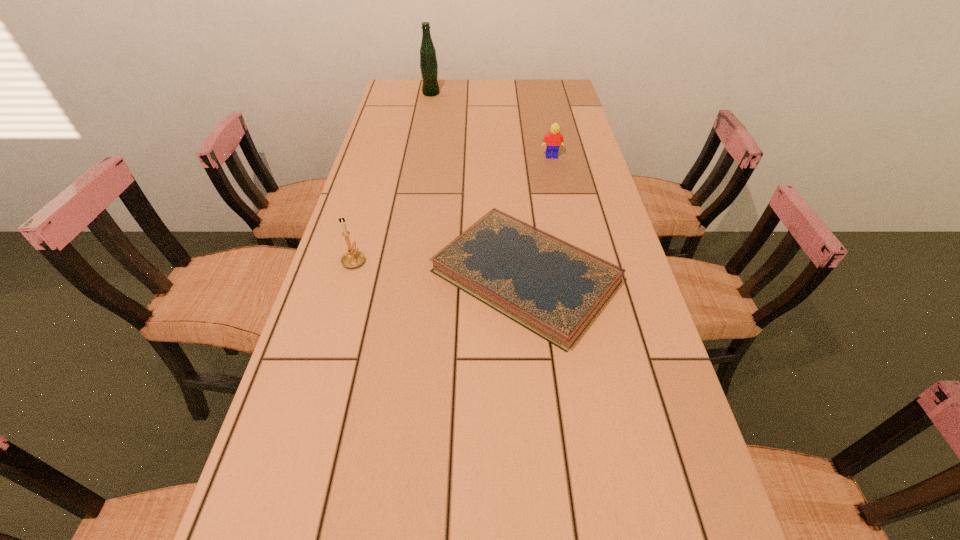
Find the location of a particular element. vacant space at the left edge is located at coordinates (351, 272).

Find the location of a particular element. vacant space at the right edge of the desktop is located at coordinates (672, 529).

This screenshot has width=960, height=540. Find the location of `vacant space at the far right corner`. vacant space at the far right corner is located at coordinates (548, 97).

The width and height of the screenshot is (960, 540). What are the coordinates of `vacant point located between the second tallest object and the third nearest object` in the screenshot? It's located at (453, 208).

In order to click on empty space that is in between the shortest object and the tallest object in this screenshot , I will do `click(478, 185)`.

I want to click on free space between the second farthest object and the beer bottle, so click(492, 125).

The width and height of the screenshot is (960, 540). Identify the location of vacant space in between the candle holder and the second farthest object. (453, 208).

You are a GUI agent. You are given a task and a screenshot of the screen. Output one action in this format:
    pyautogui.click(x=<x>, y=<y>)
    Task: Click on the vacant point located between the paperback book and the tallest object
    
    Given the screenshot: What is the action you would take?
    click(478, 185)

Find the location of `vacant area that lies between the candle holder and the farthest object`. vacant area that lies between the candle holder and the farthest object is located at coordinates (393, 177).

Where is `blank region between the third shortest object and the third tallest object`? The width and height of the screenshot is (960, 540). blank region between the third shortest object and the third tallest object is located at coordinates (453, 208).